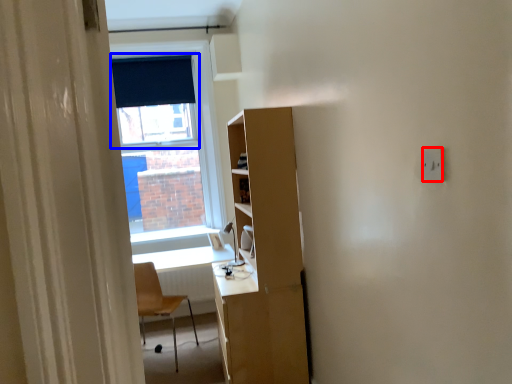
Question: Which point is further to the camera, electric outlet (highlighted by a red box) or window screen (highlighted by a blue box)?

Choices:
 (A) electric outlet
 (B) window screen

Answer: (B)